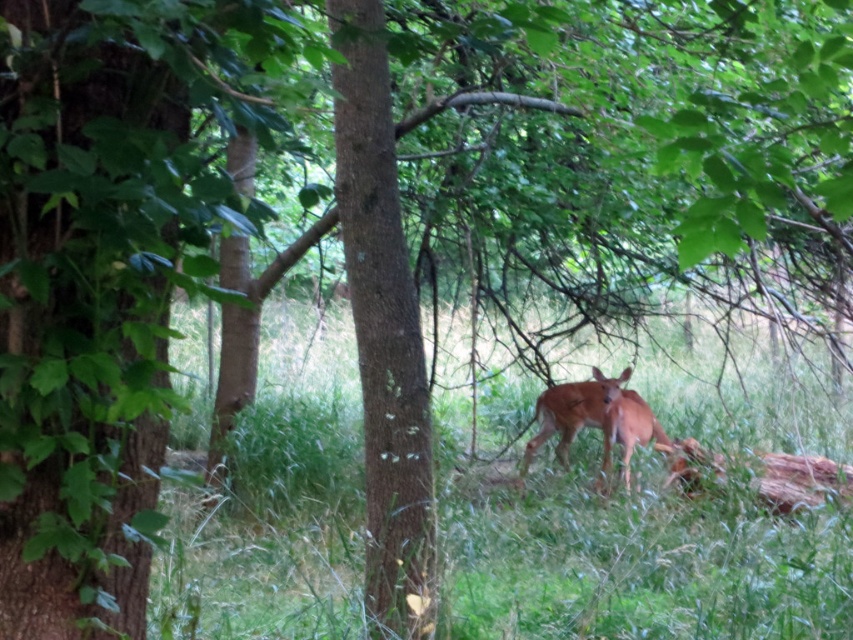
Question: Is green grass at center bigger than shiny brown deer at center?

Choices:
 (A) yes
 (B) no

Answer: (A)

Question: Can you confirm if green grass at center is positioned to the right of shiny brown deer at center?

Choices:
 (A) yes
 (B) no

Answer: (B)

Question: Which of the following is the farthest from the observer?

Choices:
 (A) green grass at center
 (B) shiny brown deer at center

Answer: (B)

Question: Is green grass at center further to the viewer compared to shiny brown deer at center?

Choices:
 (A) no
 (B) yes

Answer: (A)

Question: Which object appears farthest from the camera in this image?

Choices:
 (A) green grass at center
 (B) shiny brown deer at center

Answer: (B)